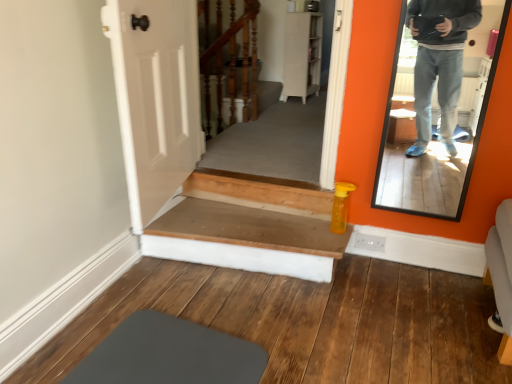
Question: Considering the positions of wooden stairs at center and matte black mirror at right in the image, is wooden stairs at center bigger or smaller than matte black mirror at right?

Choices:
 (A) big
 (B) small

Answer: (A)

Question: From the image's perspective, is wooden stairs at center above or below matte black mirror at right?

Choices:
 (A) above
 (B) below

Answer: (B)

Question: Which is farther from the wooden stairwell at center?

Choices:
 (A) wooden stairs at center
 (B) matte black mirror at right

Answer: (B)

Question: Based on their relative distances, which object is nearer to the wooden stairs at center?

Choices:
 (A) wooden stairwell at center
 (B) matte black mirror at right

Answer: (B)